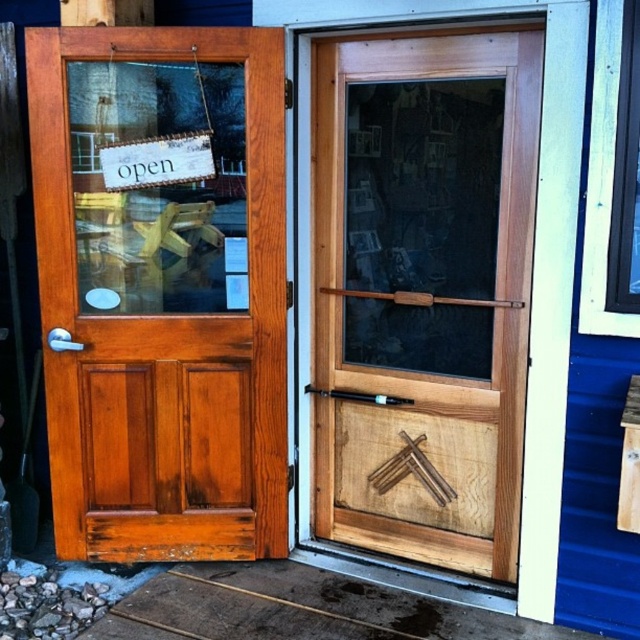
Can you confirm if natural wood screen door at center is bigger than clear glass window at upper right?

Correct, natural wood screen door at center is larger in size than clear glass window at upper right.

Is point (429, 280) more distant than point (614, 154)?

Yes, it is behind point (614, 154).

Between point (508, 404) and point (621, 161), which one is positioned in front?

Point (621, 161) is in front.

Where is `natural wood screen door at center`? This screenshot has height=640, width=640. natural wood screen door at center is located at coordinates coord(422,291).

Between point (611, 280) and point (148, 168), which one is positioned in front?

Positioned in front is point (611, 280).

Does clear glass window at upper right appear over white paper sign at upper left?

Incorrect, clear glass window at upper right is not positioned above white paper sign at upper left.

Identify the location of clear glass window at upper right. The image size is (640, 640). (625, 176).

I want to click on clear glass window at upper right, so click(625, 176).

Between shiny brown wood door at left and clear glass window at upper right, which one is positioned lower?

shiny brown wood door at left

Who is taller, shiny brown wood door at left or clear glass window at upper right?

Standing taller between the two is shiny brown wood door at left.

Who is more forward, (45, 76) or (636, 289)?

Point (636, 289) is in front.

Image resolution: width=640 pixels, height=640 pixels. I want to click on shiny brown wood door at left, so click(x=161, y=291).